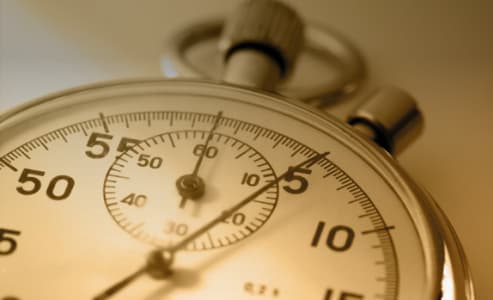
Locate an element on the screen. Image resolution: width=493 pixels, height=300 pixels. mini clock is located at coordinates (184, 193).